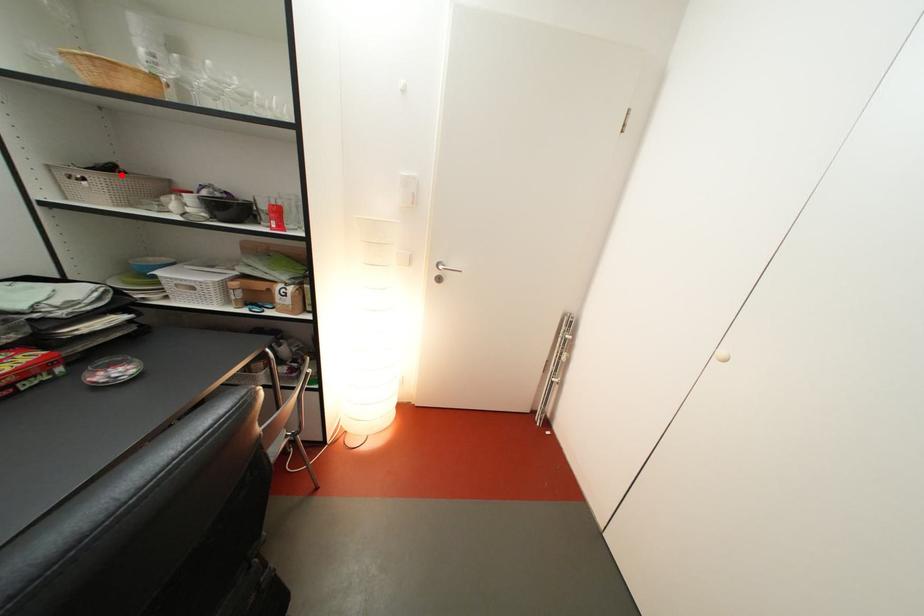
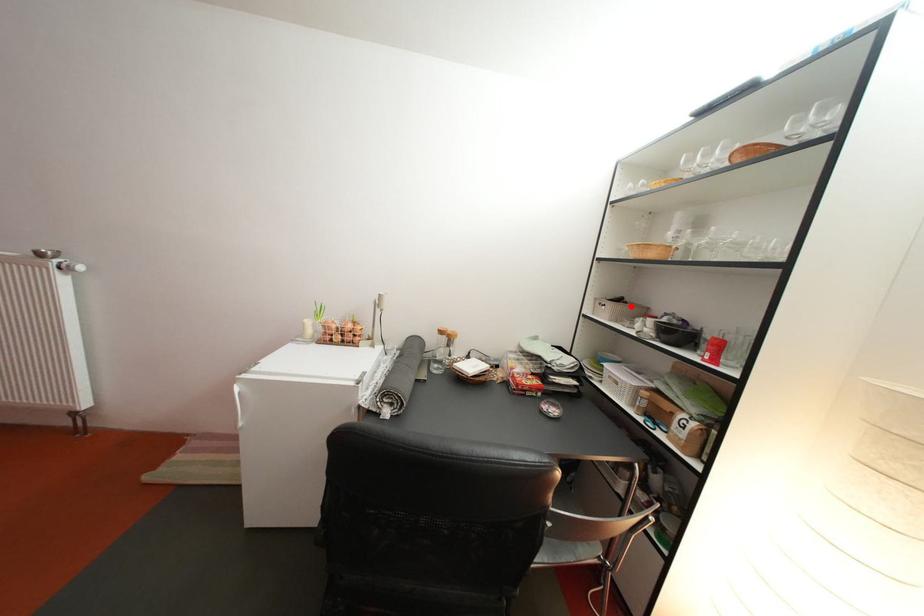
I am providing you with two images of the same scene from different viewpoints. A red point is marked on the first image and another point is marked on the second image. Is the marked point in image1 the same physical position as the marked point in image2?

Yes